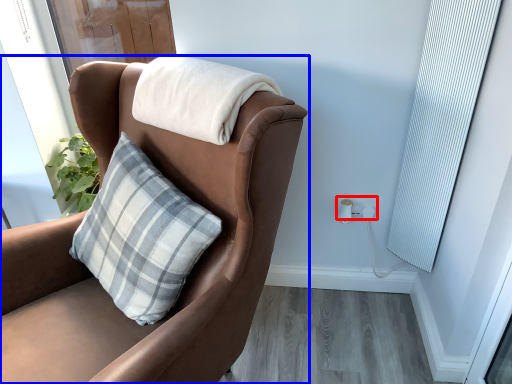
Question: Which object appears closest to the camera in this image, electric outlet (highlighted by a red box) or chair (highlighted by a blue box)?

Choices:
 (A) electric outlet
 (B) chair

Answer: (B)